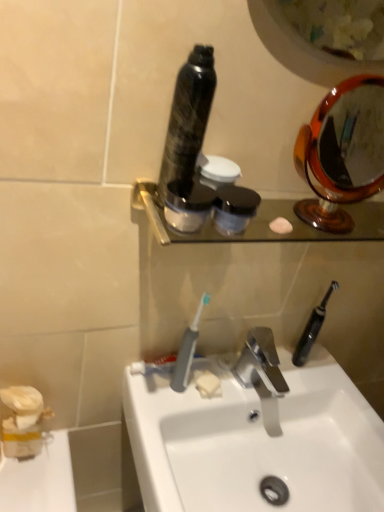
Question: Is polished chrome faucet at center taller than white glossy sink at center?

Choices:
 (A) yes
 (B) no

Answer: (B)

Question: Is polished chrome faucet at center at the left side of white glossy sink at center?

Choices:
 (A) yes
 (B) no

Answer: (B)

Question: From a real-world perspective, is polished chrome faucet at center located beneath white glossy sink at center?

Choices:
 (A) no
 (B) yes

Answer: (A)

Question: Is polished chrome faucet at center outside of white glossy sink at center?

Choices:
 (A) yes
 (B) no

Answer: (A)

Question: From a real-world perspective, is polished chrome faucet at center over white glossy sink at center?

Choices:
 (A) no
 (B) yes

Answer: (B)

Question: From a real-world perspective, is gray plastic toothbrush at center, the 2th toothbrush positioned from the right, physically located above or below shiny black bottle at center, the 1th mouthwash positioned from the top?

Choices:
 (A) above
 (B) below

Answer: (B)

Question: In terms of width, does gray plastic toothbrush at center, the 2th toothbrush positioned from the right, look wider or thinner when compared to shiny black bottle at center, the 1th mouthwash positioned from the top?

Choices:
 (A) wide
 (B) thin

Answer: (B)

Question: From the image's perspective, is gray plastic toothbrush at center, the 1th toothbrush in the left-to-right sequence, located above or below shiny black bottle at center, the 1th mouthwash positioned from the top?

Choices:
 (A) below
 (B) above

Answer: (A)

Question: Is gray plastic toothbrush at center, the 1th toothbrush from the front, to the left or to the right of shiny black bottle at center, the 1th mouthwash positioned from the top, in the image?

Choices:
 (A) left
 (B) right

Answer: (B)

Question: In terms of width, does satin black bottle at center, the 2th mouthwash when ordered from bottom to top, look wider or thinner when compared to shiny black bottle at center, the 1th mouthwash positioned from the top?

Choices:
 (A) wide
 (B) thin

Answer: (B)

Question: Is point (187, 211) positioned closer to the camera than point (195, 108)?

Choices:
 (A) closer
 (B) farther

Answer: (B)

Question: From the image's perspective, is satin black bottle at center, the 2th mouthwash when ordered from bottom to top, positioned above or below shiny black bottle at center, the 1th mouthwash positioned from the top?

Choices:
 (A) below
 (B) above

Answer: (A)

Question: Choose the correct answer: Is satin black bottle at center, acting as the 2th mouthwash starting from the top, inside shiny black bottle at center, the 1th mouthwash positioned from the top, or outside it?

Choices:
 (A) outside
 (B) inside

Answer: (A)

Question: Is polished chrome faucet at center wider or thinner than satin black bottle at center, the 2th mouthwash when ordered from bottom to top?

Choices:
 (A) thin
 (B) wide

Answer: (B)

Question: Considering the positions of polished chrome faucet at center and satin black bottle at center, the 2th mouthwash when ordered from bottom to top, in the image, is polished chrome faucet at center taller or shorter than satin black bottle at center, the 2th mouthwash when ordered from bottom to top,?

Choices:
 (A) short
 (B) tall

Answer: (B)